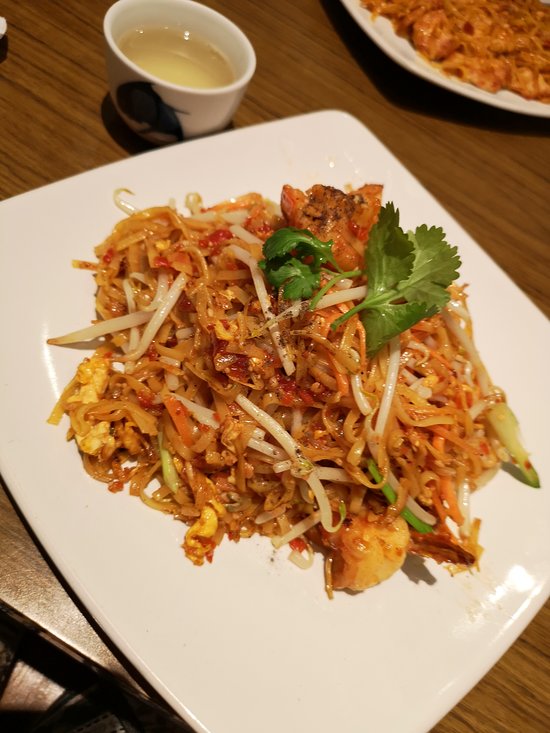
I want to click on corner, so click(336, 110).